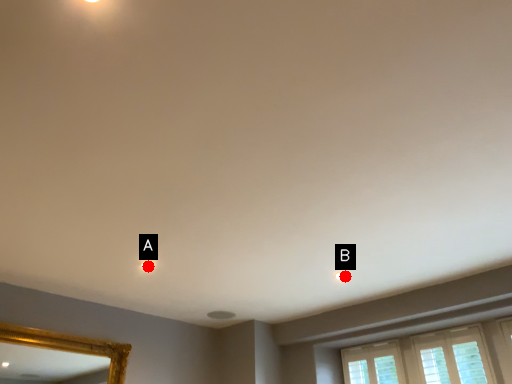
Question: Two points are circled on the image, labeled by A and B beside each circle. Among these points, which one is farthest from the camera?

Choices:
 (A) A is further
 (B) B is further

Answer: (B)